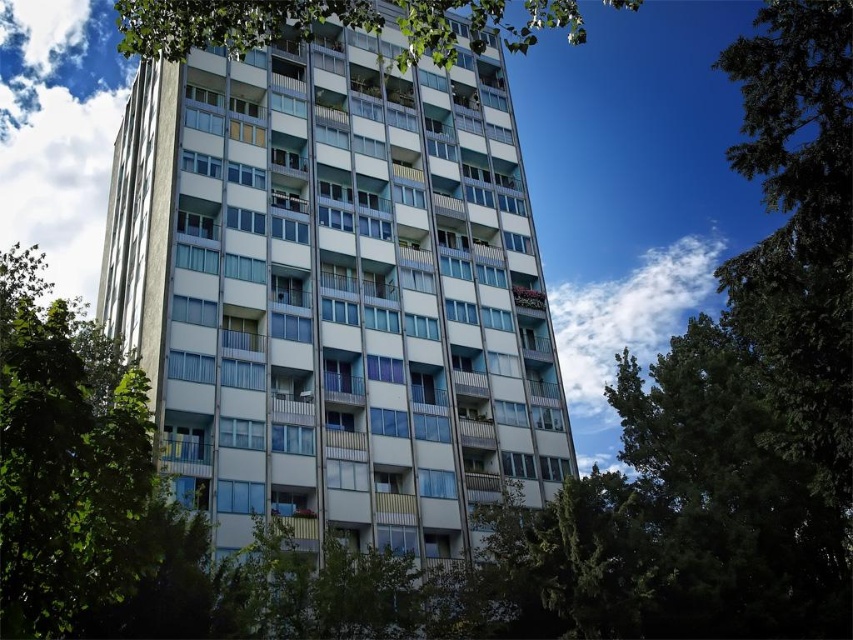
Question: Considering the relative positions of green leafy tree at center and green leafy tree at upper center in the image provided, where is green leafy tree at center located with respect to green leafy tree at upper center?

Choices:
 (A) left
 (B) right

Answer: (B)

Question: Which of these objects is positioned closest to the white glass building at center?

Choices:
 (A) green leafy tree at upper center
 (B) green leafy tree at center

Answer: (A)

Question: Is white glass building at center bigger than green leafy tree at center?

Choices:
 (A) yes
 (B) no

Answer: (B)

Question: In this image, where is white glass building at center located relative to green leafy tree at center?

Choices:
 (A) right
 (B) left

Answer: (B)

Question: Which point is farther from the camera taking this photo?

Choices:
 (A) (746, 304)
 (B) (431, 26)

Answer: (A)

Question: Which of these objects is positioned farthest from the green leafy tree at upper center?

Choices:
 (A) white glass building at center
 (B) green leafy tree at center

Answer: (B)